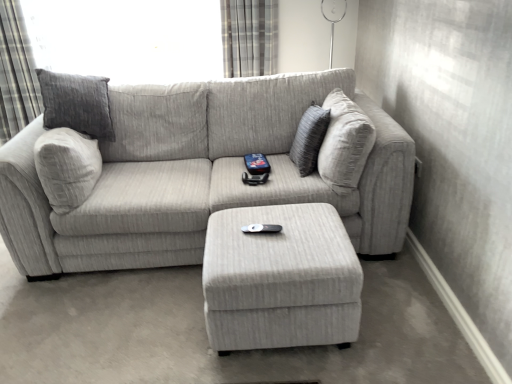
Question: In the image, is textured gray pillow at center positioned in front of or behind gray textured curtain at upper left, the 2th curtain positioned from the right?

Choices:
 (A) behind
 (B) front

Answer: (B)

Question: Does point (294, 145) appear closer or farther from the camera than point (9, 79)?

Choices:
 (A) closer
 (B) farther

Answer: (A)

Question: Based on their relative distances, which object is nearer to the textured gray couch at center?

Choices:
 (A) black plastic remote at center
 (B) gray textured curtain at upper left, the 2th curtain positioned from the right
 (C) light gray fabric ottoman at center
 (D) textured gray pillow at center
 (E) plaid fabric curtain at upper center, placed as the 2th curtain when sorted from left to right

Answer: (C)

Question: Estimate the real-world distances between objects in this image. Which object is farther from the light gray fabric ottoman at center?

Choices:
 (A) plaid fabric curtain at upper center, placed as the 2th curtain when sorted from left to right
 (B) textured gray couch at center
 (C) gray textured curtain at upper left, the 2th curtain positioned from the right
 (D) black plastic remote at center
 (E) textured gray pillow at center

Answer: (C)